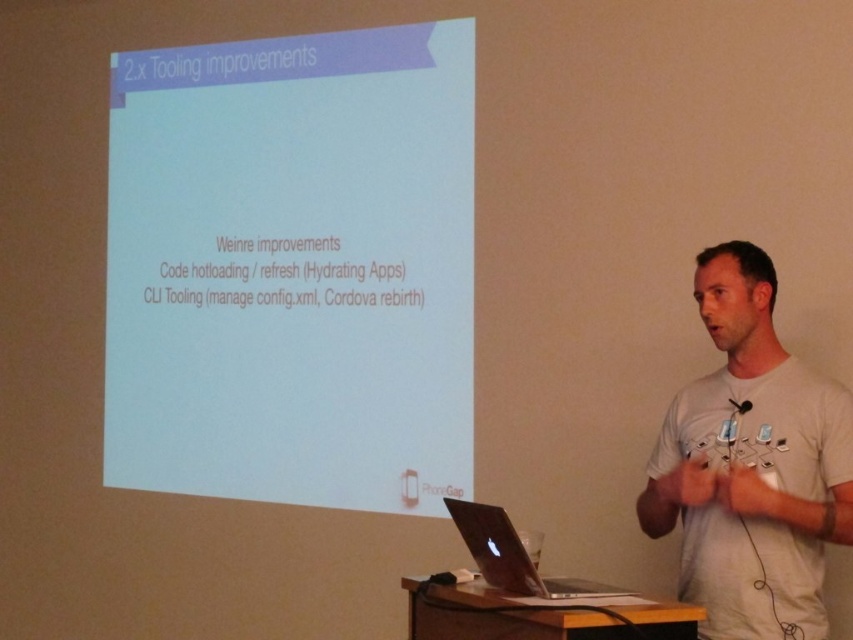
Can you confirm if white cotton t-shirt at center is positioned to the left of silver metallic laptop at center?

Incorrect, white cotton t-shirt at center is not on the left side of silver metallic laptop at center.

Can you confirm if white cotton t-shirt at center is positioned below silver metallic laptop at center?

No.

Where is `white cotton t-shirt at center`? The image size is (853, 640). white cotton t-shirt at center is located at coordinates (751, 465).

Image resolution: width=853 pixels, height=640 pixels. What do you see at coordinates (293, 268) in the screenshot? I see `white matte projector screen at upper center` at bounding box center [293, 268].

The height and width of the screenshot is (640, 853). Describe the element at coordinates (293, 268) in the screenshot. I see `white matte projector screen at upper center` at that location.

Find the location of a particular element. Image resolution: width=853 pixels, height=640 pixels. white matte projector screen at upper center is located at coordinates (293, 268).

Is point (369, 241) positioned after point (480, 520)?

Yes, it is.

Which of these two, white matte projector screen at upper center or silver metallic laptop at center, stands shorter?

With less height is silver metallic laptop at center.

Identify the location of white matte projector screen at upper center. (293, 268).